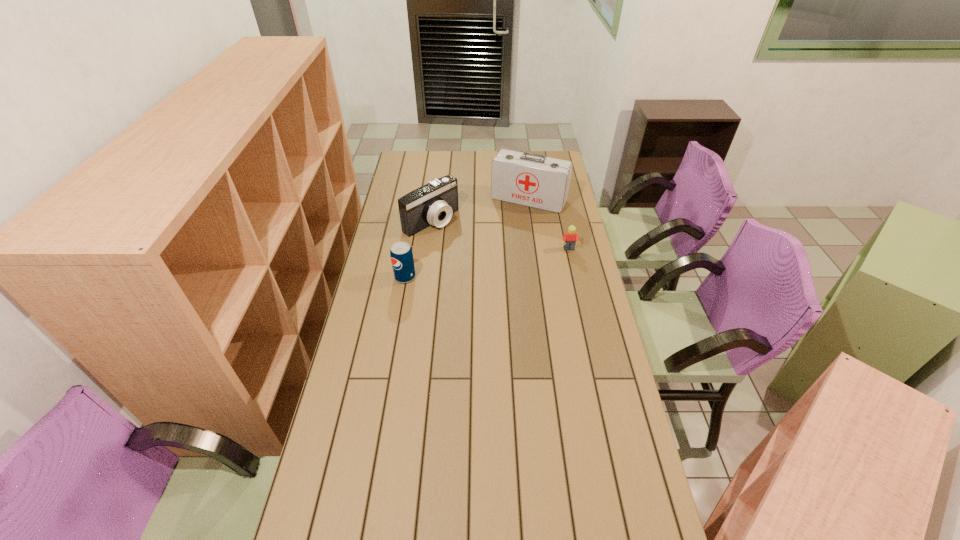
Where is `the second shortest object`? the second shortest object is located at coordinates (401, 254).

Find the location of a particular element. The width and height of the screenshot is (960, 540). the nearest object is located at coordinates (401, 254).

Find the location of a particular element. The height and width of the screenshot is (540, 960). Lego is located at coordinates pyautogui.click(x=570, y=238).

You are a GUI agent. You are given a task and a screenshot of the screen. Output one action in this format:
    pyautogui.click(x=<x>, y=<y>)
    Task: Click on the second nearest object
    
    Given the screenshot: What is the action you would take?
    pyautogui.click(x=570, y=238)

Find the location of `the second tallest object`. the second tallest object is located at coordinates (434, 203).

The image size is (960, 540). Find the location of `the tallest object`. the tallest object is located at coordinates (529, 179).

Identify the location of vacant space located on the left of the nearest object. This screenshot has width=960, height=540. (382, 277).

At what (x,y) coordinates should I click in order to perform the action: click on vacant space located 0.280m on the face of the Lego. Please return your answer as a coordinate pair (x, y). The image size is (960, 540). Looking at the image, I should click on (581, 301).

I want to click on free region located 0.120m on the lens of the second tallest object, so click(x=468, y=245).

This screenshot has height=540, width=960. In order to click on vacant space situated on the lens of the second tallest object in this screenshot , I will do `click(477, 252)`.